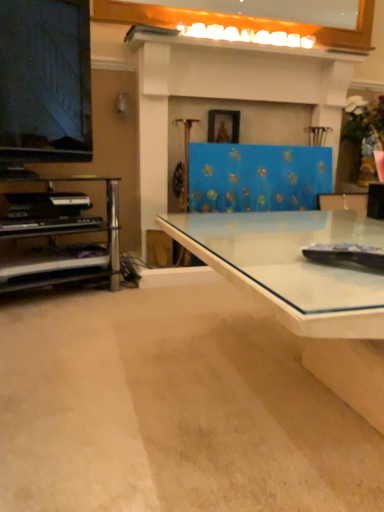
Question: Can you confirm if metallic silver shelf at left is thinner than white glossy mantle at upper center?

Choices:
 (A) yes
 (B) no

Answer: (B)

Question: Is white glossy mantle at upper center located within metallic silver shelf at left?

Choices:
 (A) no
 (B) yes

Answer: (A)

Question: From a real-world perspective, does metallic silver shelf at left stand above white glossy mantle at upper center?

Choices:
 (A) yes
 (B) no

Answer: (B)

Question: From the image's perspective, is metallic silver shelf at left beneath white glossy mantle at upper center?

Choices:
 (A) no
 (B) yes

Answer: (B)

Question: Does metallic silver shelf at left have a greater height compared to white glossy mantle at upper center?

Choices:
 (A) no
 (B) yes

Answer: (B)

Question: Would you say transparent glass desk at center is inside or outside matte black television at left?

Choices:
 (A) outside
 (B) inside

Answer: (A)

Question: In terms of width, does transparent glass desk at center look wider or thinner when compared to matte black television at left?

Choices:
 (A) thin
 (B) wide

Answer: (B)

Question: From the image's perspective, is transparent glass desk at center positioned above or below matte black television at left?

Choices:
 (A) above
 (B) below

Answer: (B)

Question: Based on their positions, is transparent glass desk at center located to the left or right of matte black television at left?

Choices:
 (A) left
 (B) right

Answer: (B)

Question: Based on their positions, is black matte piano at left located to the left or right of metallic silver shelf at left?

Choices:
 (A) left
 (B) right

Answer: (A)

Question: Do you think black matte piano at left is within metallic silver shelf at left, or outside of it?

Choices:
 (A) outside
 (B) inside

Answer: (B)

Question: From a real-world perspective, is black matte piano at left positioned above or below metallic silver shelf at left?

Choices:
 (A) below
 (B) above

Answer: (B)

Question: Is point (24, 226) closer or farther from the camera than point (41, 205)?

Choices:
 (A) farther
 (B) closer

Answer: (B)

Question: Considering their positions, is transparent glass desk at center located in front of or behind metallic silver shelf at left?

Choices:
 (A) front
 (B) behind

Answer: (A)

Question: Does point (316, 303) appear closer or farther from the camera than point (38, 241)?

Choices:
 (A) farther
 (B) closer

Answer: (B)